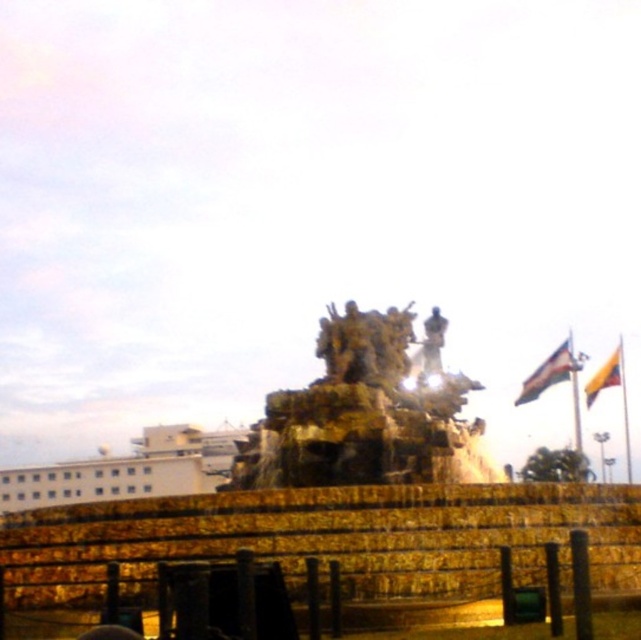
Between gold metallic fountain at center and white smooth building at lower left, which one has less height?

With less height is white smooth building at lower left.

Does gold metallic fountain at center have a greater height compared to white smooth building at lower left?

Indeed, gold metallic fountain at center has a greater height compared to white smooth building at lower left.

The height and width of the screenshot is (640, 641). Identify the location of gold metallic fountain at center. (331, 516).

Is gold textured statue at center to the left of polished bronze statue at center from the viewer's perspective?

Indeed, gold textured statue at center is positioned on the left side of polished bronze statue at center.

The width and height of the screenshot is (641, 640). Describe the element at coordinates (365, 344) in the screenshot. I see `gold textured statue at center` at that location.

Locate an element on the screen. The image size is (641, 640). gold textured statue at center is located at coordinates (365, 344).

I want to click on gold textured statue at center, so click(x=365, y=344).

Identify the location of golden stone fountain at center. The height and width of the screenshot is (640, 641). point(362,417).

In the scene shown: Which of these two, golden stone fountain at center or white smooth building at lower left, stands taller?

Standing taller between the two is golden stone fountain at center.

This screenshot has width=641, height=640. Describe the element at coordinates (362, 417) in the screenshot. I see `golden stone fountain at center` at that location.

Where is `golden stone fountain at center`? golden stone fountain at center is located at coordinates (362, 417).